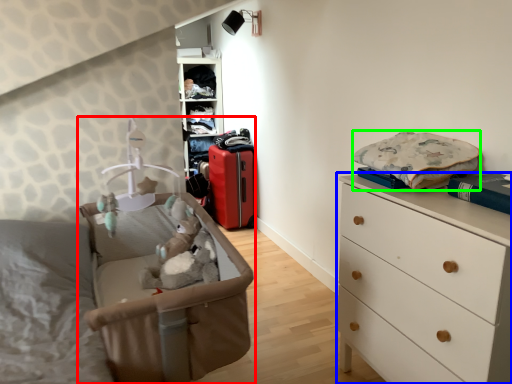
Question: Estimate the real-world distances between objects in this image. Which object is closer to infant bed (highlighted by a red box), chest of drawers (highlighted by a blue box) or clothing (highlighted by a green box)?

Choices:
 (A) chest of drawers
 (B) clothing

Answer: (A)